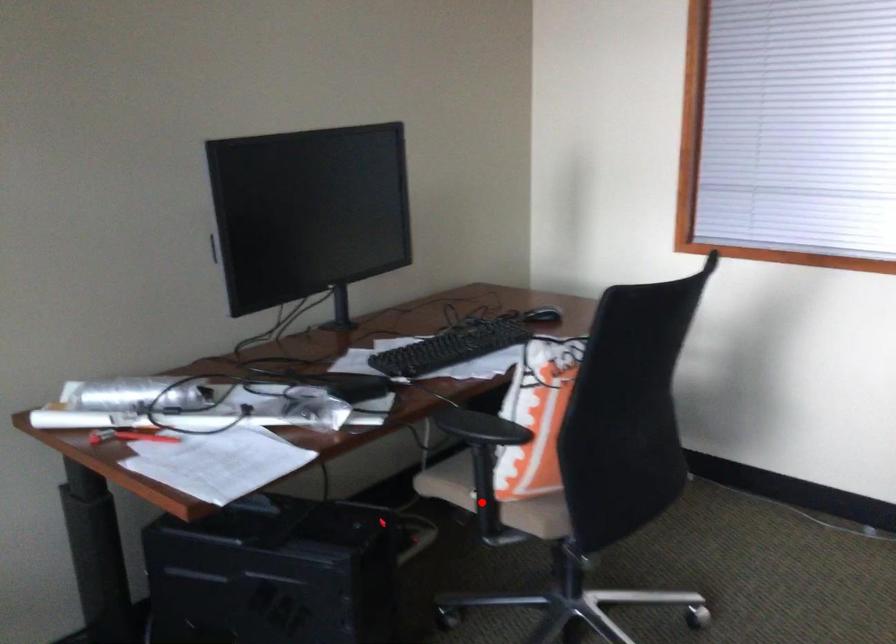
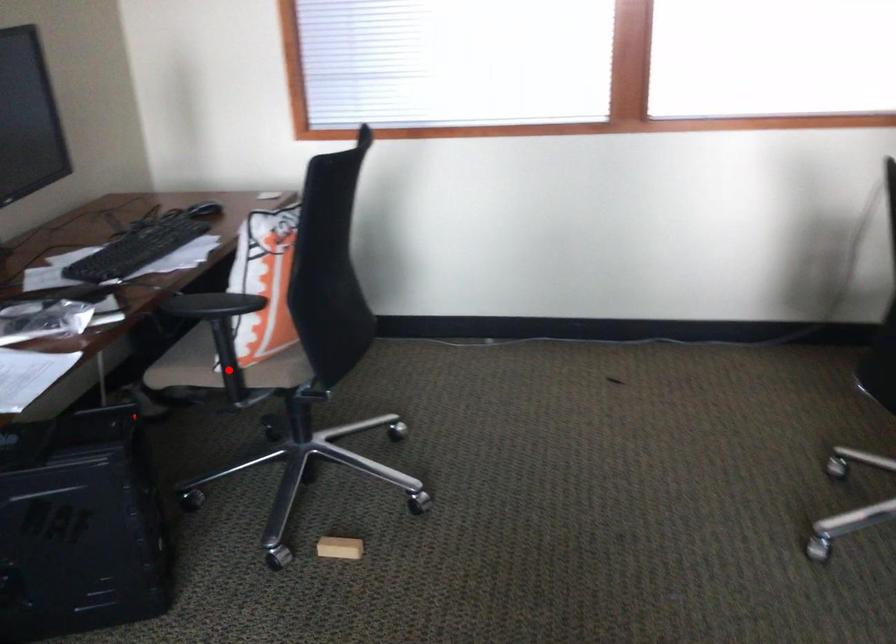
I am providing you with two images of the same scene from different viewpoints. A red point is marked on the first image and another point is marked on the second image. Do the highlighted points in image1 and image2 indicate the same real-world spot?

Yes